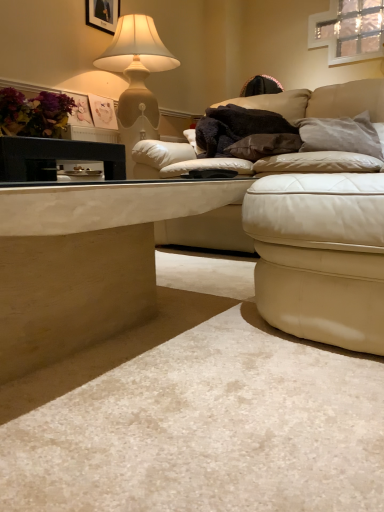
Question: Is matte beige lamp at upper left further to camera compared to smooth beige table at lower left, the 2th table positioned from the top?

Choices:
 (A) no
 (B) yes

Answer: (B)

Question: Considering the relative sizes of matte beige lamp at upper left and smooth beige table at lower left, the 2th table positioned from the top, in the image provided, is matte beige lamp at upper left wider than smooth beige table at lower left, the 2th table positioned from the top,?

Choices:
 (A) yes
 (B) no

Answer: (B)

Question: Considering the relative positions of matte beige lamp at upper left and smooth beige table at lower left, acting as the 1th table starting from the bottom, in the image provided, is matte beige lamp at upper left to the left of smooth beige table at lower left, acting as the 1th table starting from the bottom, from the viewer's perspective?

Choices:
 (A) no
 (B) yes

Answer: (B)

Question: Would you say matte beige lamp at upper left is outside smooth beige table at lower left, the 2th table positioned from the top?

Choices:
 (A) yes
 (B) no

Answer: (A)

Question: Does matte beige lamp at upper left have a greater height compared to smooth beige table at lower left, the 2th table positioned from the top?

Choices:
 (A) yes
 (B) no

Answer: (A)

Question: From a real-world perspective, relative to black glossy table at left, the 2th table positioned from the bottom, is leather ottoman at lower right vertically above or below?

Choices:
 (A) above
 (B) below

Answer: (B)

Question: Considering the relative positions of leather ottoman at lower right and black glossy table at left, which is the 1th table from top to bottom, in the image provided, is leather ottoman at lower right to the left or to the right of black glossy table at left, which is the 1th table from top to bottom,?

Choices:
 (A) left
 (B) right

Answer: (B)

Question: From the image's perspective, is leather ottoman at lower right above or below black glossy table at left, the 2th table positioned from the bottom?

Choices:
 (A) above
 (B) below

Answer: (B)

Question: In the image, is leather ottoman at lower right positioned in front of or behind black glossy table at left, the 2th table positioned from the bottom?

Choices:
 (A) behind
 (B) front

Answer: (B)

Question: Do you think clear glass window at upper right is within brown suede pillow at center, the 1th pillow viewed from the left, or outside of it?

Choices:
 (A) inside
 (B) outside

Answer: (B)

Question: Based on their positions, is clear glass window at upper right located to the left or right of brown suede pillow at center, the 1th pillow viewed from the left?

Choices:
 (A) left
 (B) right

Answer: (B)

Question: From the image's perspective, is clear glass window at upper right above or below brown suede pillow at center, which is counted as the second pillow, starting from the right?

Choices:
 (A) above
 (B) below

Answer: (A)

Question: Is clear glass window at upper right bigger or smaller than brown suede pillow at center, the 1th pillow viewed from the left?

Choices:
 (A) small
 (B) big

Answer: (B)

Question: Is matte purple flowers at upper left situated inside black fuzzy blanket at center or outside?

Choices:
 (A) inside
 (B) outside

Answer: (B)

Question: From the image's perspective, relative to black fuzzy blanket at center, is matte purple flowers at upper left above or below?

Choices:
 (A) below
 (B) above

Answer: (B)